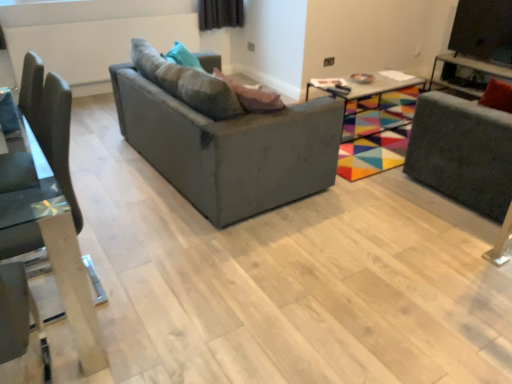
Locate an element on the screen. Image resolution: width=512 pixels, height=384 pixels. free spot in front of matte gray couch at center is located at coordinates (230, 261).